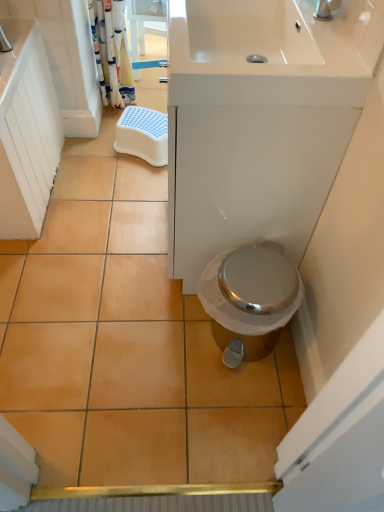
Question: From the image's perspective, is white glossy sink at upper center on top of white plastic step stool at center?

Choices:
 (A) no
 (B) yes

Answer: (B)

Question: Does white glossy sink at upper center have a greater height compared to white plastic step stool at center?

Choices:
 (A) no
 (B) yes

Answer: (A)

Question: Does white glossy sink at upper center have a lesser width compared to white plastic step stool at center?

Choices:
 (A) no
 (B) yes

Answer: (A)

Question: Does white glossy sink at upper center have a larger size compared to white plastic step stool at center?

Choices:
 (A) yes
 (B) no

Answer: (A)

Question: Is white glossy sink at upper center wider than white plastic step stool at center?

Choices:
 (A) no
 (B) yes

Answer: (B)

Question: Based on their positions, is white plastic step stool at center located to the left or right of white fabric shower curtain at upper left?

Choices:
 (A) left
 (B) right

Answer: (B)

Question: Would you say white plastic step stool at center is inside or outside white fabric shower curtain at upper left?

Choices:
 (A) inside
 (B) outside

Answer: (B)

Question: From the image's perspective, is white plastic step stool at center positioned above or below white fabric shower curtain at upper left?

Choices:
 (A) above
 (B) below

Answer: (B)

Question: Considering the positions of point (150, 116) and point (122, 52), is point (150, 116) closer or farther from the camera than point (122, 52)?

Choices:
 (A) farther
 (B) closer

Answer: (B)

Question: Based on their sizes in the image, would you say white plastic step stool at center is bigger or smaller than white glossy sink at upper center?

Choices:
 (A) small
 (B) big

Answer: (A)

Question: Is white plastic step stool at center in front of or behind white glossy sink at upper center in the image?

Choices:
 (A) behind
 (B) front

Answer: (A)

Question: Is white plastic step stool at center taller or shorter than white glossy sink at upper center?

Choices:
 (A) short
 (B) tall

Answer: (B)

Question: Would you say white plastic step stool at center is to the left or to the right of white glossy sink at upper center in the picture?

Choices:
 (A) right
 (B) left

Answer: (B)

Question: In terms of width, does white glossy sink at upper center look wider or thinner when compared to white plastic step stool at center?

Choices:
 (A) thin
 (B) wide

Answer: (B)

Question: Visually, is white glossy sink at upper center positioned to the left or to the right of white plastic step stool at center?

Choices:
 (A) right
 (B) left

Answer: (A)